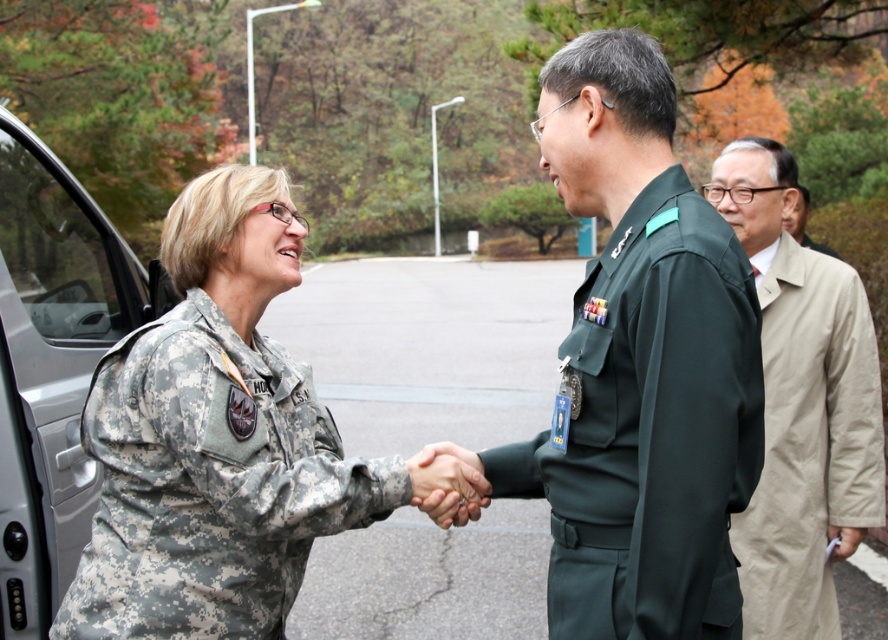
You are a military photographer tasked with capturing a group photo. You notice the camouflage fabric uniform at center and the beige trench coat at right. Which object is positioned lower in the image?

The camouflage fabric uniform at center is located below the beige trench coat at right, so it is positioned lower in the image.

You are a military photographer tasked with capturing a group photo of the green uniform at center and the tan fabric coat at right. Your camera has a maximum focus range of 2 meters. Will you be able to include both subjects in focus without moving either of them?

The distance between the green uniform at center and the tan fabric coat at right is 2.12 meters, which exceeds the camera maximum focus range of 2 meters. Therefore, you cannot include both subjects in focus without moving them.

You are a photographer positioned in front of the two military personnel. You notice two points marked in the image at coordinates point (635, 508) and point (821, 275). Which point is nearer to you?

Point (635, 508) is closer to the viewer than point (821, 275).